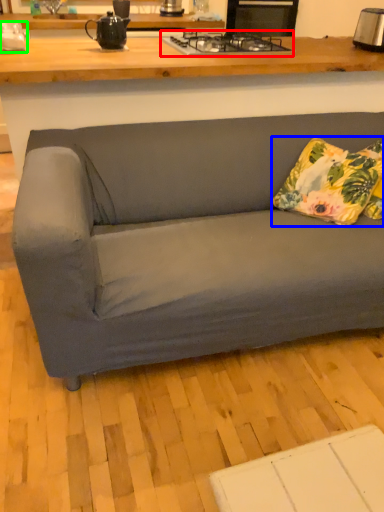
Question: Based on their relative distances, which object is farther from gas stove (highlighted by a red box)? Choose from pillow (highlighted by a blue box) and appliance (highlighted by a green box).

Choices:
 (A) pillow
 (B) appliance

Answer: (B)